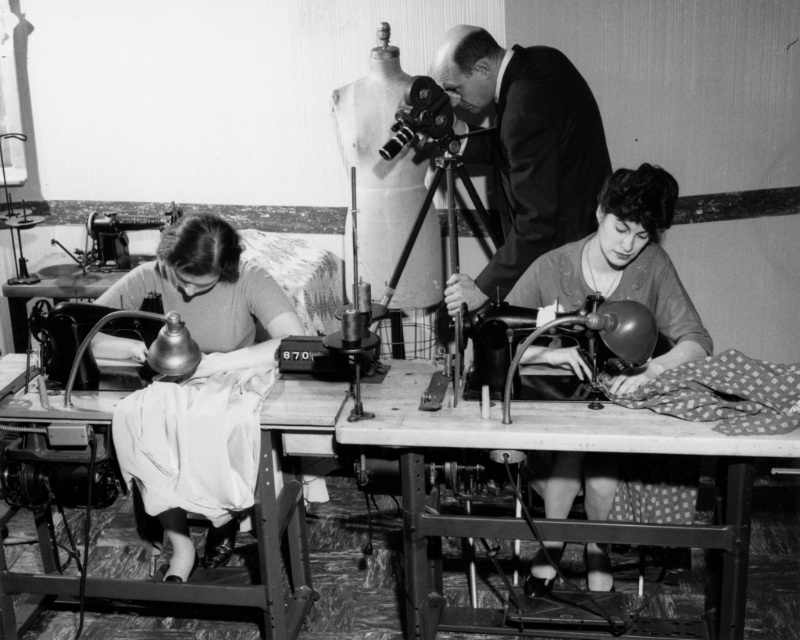
You are a customer who wants to see the dress displayed on a mannequin. The store assistant tells you that the dress is currently placed near a sewing machine. According to the image provided, can you determine if the dotted fabric dress at lower center is in front of or behind the metallic sewing machine at left?

The dotted fabric dress at lower center is in front of the metallic sewing machine at left, so it is already positioned where you can see it without needing to move the sewing machine.

You are a tailor who needs to place the dotted fabric dress at lower center and the metallic sewing machine at left onto a storage shelf. The shelf has a weight limit of 20 kilograms. If the dress weighs 3 kilograms and the sewing machine weighs 15 kilograms, will both items fit on the shelf without exceeding the weight limit?

The dotted fabric dress at lower center weighs 3 kilograms and the metallic sewing machine at left weighs 15 kilograms. Combined, they total 18 kilograms, which is under the 20 kilogram limit. Therefore, both items can be placed on the shelf without exceeding the weight limit.

You are a photographer standing at the camera position in the sewing workshop scene. You want to place a small tripod between the wooden table at center and the camera. Is there enough space for the tripod, which requires at least 1.5 meters of clearance between the table and the camera?

The wooden table at center and the camera are 2.11 meters apart, which is more than the required 1.5 meters clearance. Therefore, there is enough space to place the tripod between the wooden table at center and the camera.